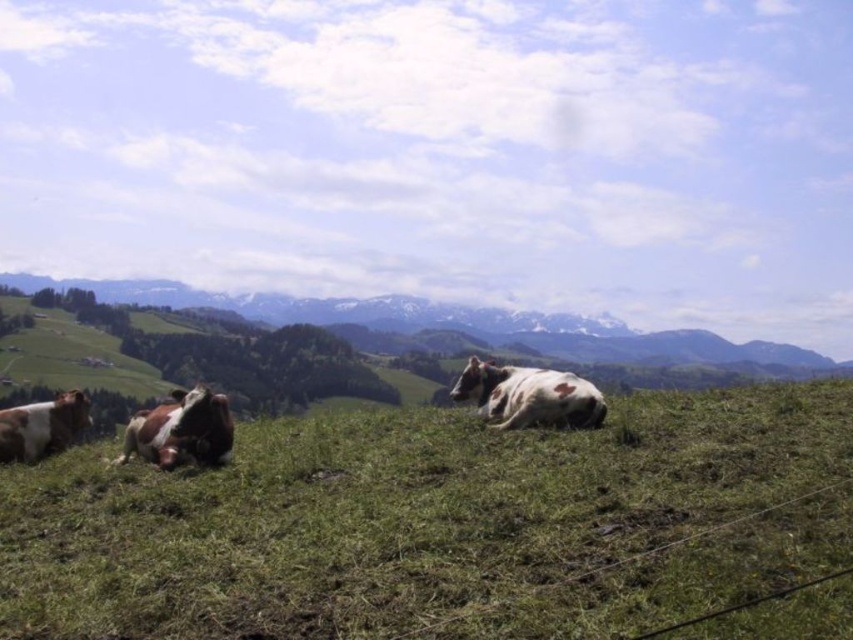
Question: Estimate the real-world distances between objects in this image. Which object is closer to the white spotted cow at center?

Choices:
 (A) white and brown spotted cow at left
 (B) green grassy field at center

Answer: (B)

Question: Estimate the real-world distances between objects in this image. Which object is closer to the white spotted cow at center?

Choices:
 (A) white and brown spotted cow at left
 (B) green grassy field at center

Answer: (B)

Question: Where is white spotted cow at center located in relation to white and brown spotted cow at left in the image?

Choices:
 (A) below
 (B) above

Answer: (B)

Question: Is white spotted cow at center behind white and brown spotted cow at left?

Choices:
 (A) yes
 (B) no

Answer: (B)

Question: Which point is closer to the camera?

Choices:
 (A) white spotted cow at center
 (B) green grassy field at center

Answer: (B)

Question: Can you confirm if green grassy field at center is positioned to the right of white and brown spotted cow at left?

Choices:
 (A) yes
 (B) no

Answer: (A)